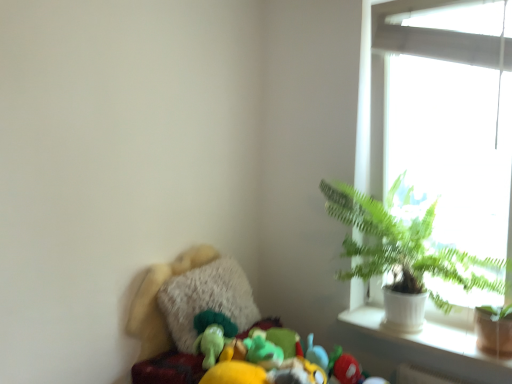
Question: Is green leafy plant at upper right inside the boundaries of white ceramic pot at upper right, or outside?

Choices:
 (A) inside
 (B) outside

Answer: (B)

Question: Considering the positions of green leafy plant at upper right and white ceramic pot at upper right in the image, is green leafy plant at upper right taller or shorter than white ceramic pot at upper right?

Choices:
 (A) short
 (B) tall

Answer: (B)

Question: Which object is the closest to the white glass window at upper right?

Choices:
 (A) white ceramic pot at upper right
 (B) white ceramic pot at right
 (C) green leafy plant at upper right

Answer: (C)

Question: Which is nearer to the white glass window at upper right?

Choices:
 (A) white ceramic pot at right
 (B) green leafy plant at upper right
 (C) white ceramic pot at upper right

Answer: (B)